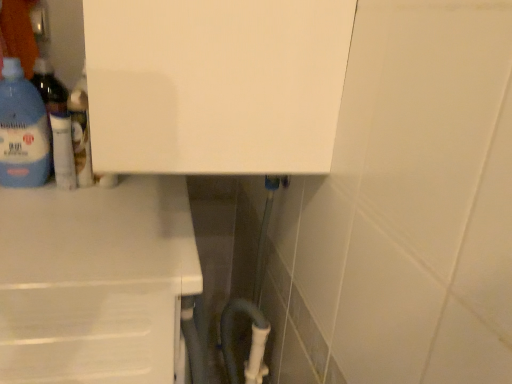
What do you see at coordinates (22, 130) in the screenshot?
I see `translucent plastic bottle at left, which appears as the 1th bottle when viewed from the left` at bounding box center [22, 130].

The image size is (512, 384). What do you see at coordinates (81, 131) in the screenshot?
I see `white glossy lotion at upper left, marked as the 1th bottle in a right-to-left arrangement` at bounding box center [81, 131].

Describe the element at coordinates (95, 281) in the screenshot. This screenshot has width=512, height=384. I see `white matte counter at lower left` at that location.

This screenshot has width=512, height=384. I want to click on translucent plastic bottle at left, the 2th bottle positioned from the right, so (x=22, y=130).

Can you confirm if white matte counter at lower left is taller than translucent plastic bottle at left, the 2th bottle positioned from the right?

Yes, white matte counter at lower left is taller than translucent plastic bottle at left, the 2th bottle positioned from the right.

Measure the distance between white matte counter at lower left and translucent plastic bottle at left, the 2th bottle positioned from the right.

They are 11.86 inches apart.

At what (x,y) coordinates should I click in order to perform the action: click on counter beneath the translucent plastic bottle at left, the 2th bottle positioned from the right (from a real-world perspective). Please return your answer as a coordinate pair (x, y). The height and width of the screenshot is (384, 512). Looking at the image, I should click on (95, 281).

From the picture: Is white matte counter at lower left in contact with white glossy lotion at upper left, marked as the 1th bottle in a right-to-left arrangement?

No, white matte counter at lower left is not beside white glossy lotion at upper left, marked as the 1th bottle in a right-to-left arrangement.

Which of these two, white matte counter at lower left or white glossy lotion at upper left, the 2th bottle when ordered from left to right, is smaller?

white glossy lotion at upper left, the 2th bottle when ordered from left to right.

Is the depth of white matte counter at lower left less than that of white glossy lotion at upper left, the 2th bottle when ordered from left to right?

Yes, white matte counter at lower left is closer to the camera.

Is point (48, 221) positioned after point (76, 161)?

No, (48, 221) is in front of (76, 161).

Which object is more forward, translucent plastic bottle at left, the 2th bottle positioned from the right, or white glossy lotion at upper left, the 2th bottle when ordered from left to right?

Positioned in front is translucent plastic bottle at left, the 2th bottle positioned from the right.

Can you confirm if translucent plastic bottle at left, the 2th bottle positioned from the right, is taller than white glossy lotion at upper left, marked as the 1th bottle in a right-to-left arrangement?

Yes.

Can you confirm if translucent plastic bottle at left, the 2th bottle positioned from the right, is positioned to the right of white glossy lotion at upper left, the 2th bottle when ordered from left to right?

No, translucent plastic bottle at left, the 2th bottle positioned from the right, is not to the right of white glossy lotion at upper left, the 2th bottle when ordered from left to right.

Does translucent plastic bottle at left, which appears as the 1th bottle when viewed from the left, turn towards white matte counter at lower left?

No, translucent plastic bottle at left, which appears as the 1th bottle when viewed from the left, is not oriented towards white matte counter at lower left.

Considering the sizes of objects translucent plastic bottle at left, which appears as the 1th bottle when viewed from the left, and white matte counter at lower left in the image provided, who is shorter, translucent plastic bottle at left, which appears as the 1th bottle when viewed from the left, or white matte counter at lower left?

translucent plastic bottle at left, which appears as the 1th bottle when viewed from the left.

Is translucent plastic bottle at left, the 2th bottle positioned from the right, wider than white matte counter at lower left?

Incorrect, the width of translucent plastic bottle at left, the 2th bottle positioned from the right, does not surpass that of white matte counter at lower left.

Which is more to the right, translucent plastic bottle at left, which appears as the 1th bottle when viewed from the left, or white matte counter at lower left?

white matte counter at lower left is more to the right.

Is white glossy lotion at upper left, the 2th bottle when ordered from left to right, facing towards translucent plastic bottle at left, the 2th bottle positioned from the right?

No, white glossy lotion at upper left, the 2th bottle when ordered from left to right, is not turned towards translucent plastic bottle at left, the 2th bottle positioned from the right.

Which is more to the left, white glossy lotion at upper left, marked as the 1th bottle in a right-to-left arrangement, or translucent plastic bottle at left, the 2th bottle positioned from the right?

From the viewer's perspective, translucent plastic bottle at left, the 2th bottle positioned from the right, appears more on the left side.

Can translucent plastic bottle at left, which appears as the 1th bottle when viewed from the left, be found inside white glossy lotion at upper left, marked as the 1th bottle in a right-to-left arrangement?

No, translucent plastic bottle at left, which appears as the 1th bottle when viewed from the left, is not surrounded by white glossy lotion at upper left, marked as the 1th bottle in a right-to-left arrangement.

Does white glossy lotion at upper left, the 2th bottle when ordered from left to right, have a larger size compared to white matte counter at lower left?

No.

Would you say white glossy lotion at upper left, marked as the 1th bottle in a right-to-left arrangement, is outside white matte counter at lower left?

Yes, white glossy lotion at upper left, marked as the 1th bottle in a right-to-left arrangement, is located beyond the bounds of white matte counter at lower left.

How many degrees apart are the facing directions of white glossy lotion at upper left, marked as the 1th bottle in a right-to-left arrangement, and white matte counter at lower left?

89.3 degrees separate the facing orientations of white glossy lotion at upper left, marked as the 1th bottle in a right-to-left arrangement, and white matte counter at lower left.

Is white glossy lotion at upper left, marked as the 1th bottle in a right-to-left arrangement, to the left of white matte counter at lower left from the viewer's perspective?

No.

Identify the location of the 1st bottle behind the white matte counter at lower left. This screenshot has width=512, height=384. (22, 130).

Where is `counter below the white glossy lotion at upper left, the 2th bottle when ordered from left to right (from the image's perspective)`? The image size is (512, 384). counter below the white glossy lotion at upper left, the 2th bottle when ordered from left to right (from the image's perspective) is located at coordinates (95, 281).

Which object lies further to the anchor point white glossy lotion at upper left, the 2th bottle when ordered from left to right, white matte counter at lower left or translucent plastic bottle at left, which appears as the 1th bottle when viewed from the left?

Based on the image, white matte counter at lower left appears to be further to white glossy lotion at upper left, the 2th bottle when ordered from left to right.

Based on their spatial positions, is white glossy lotion at upper left, the 2th bottle when ordered from left to right, or white matte counter at lower left closer to translucent plastic bottle at left, the 2th bottle positioned from the right?

white glossy lotion at upper left, the 2th bottle when ordered from left to right, is positioned closer to the anchor translucent plastic bottle at left, the 2th bottle positioned from the right.

Estimate the real-world distances between objects in this image. Which object is closer to translucent plastic bottle at left, which appears as the 1th bottle when viewed from the left, white matte counter at lower left or white glossy lotion at upper left, marked as the 1th bottle in a right-to-left arrangement?

Based on the image, white glossy lotion at upper left, marked as the 1th bottle in a right-to-left arrangement, appears to be nearer to translucent plastic bottle at left, which appears as the 1th bottle when viewed from the left.

Based on the photo, when comparing their distances from white glossy lotion at upper left, the 2th bottle when ordered from left to right, does translucent plastic bottle at left, which appears as the 1th bottle when viewed from the left, or white matte counter at lower left seem closer?

Among the two, translucent plastic bottle at left, which appears as the 1th bottle when viewed from the left, is located nearer to white glossy lotion at upper left, the 2th bottle when ordered from left to right.

From the image, which object appears to be nearer to white matte counter at lower left, white glossy lotion at upper left, marked as the 1th bottle in a right-to-left arrangement, or translucent plastic bottle at left, which appears as the 1th bottle when viewed from the left?

Based on the image, white glossy lotion at upper left, marked as the 1th bottle in a right-to-left arrangement, appears to be nearer to white matte counter at lower left.

When comparing their distances from white matte counter at lower left, does translucent plastic bottle at left, which appears as the 1th bottle when viewed from the left, or white glossy lotion at upper left, marked as the 1th bottle in a right-to-left arrangement, seem further?

The object further to white matte counter at lower left is translucent plastic bottle at left, which appears as the 1th bottle when viewed from the left.

Where is `bottle between translucent plastic bottle at left, the 2th bottle positioned from the right, and white matte counter at lower left from top to bottom`? bottle between translucent plastic bottle at left, the 2th bottle positioned from the right, and white matte counter at lower left from top to bottom is located at coordinates (81, 131).